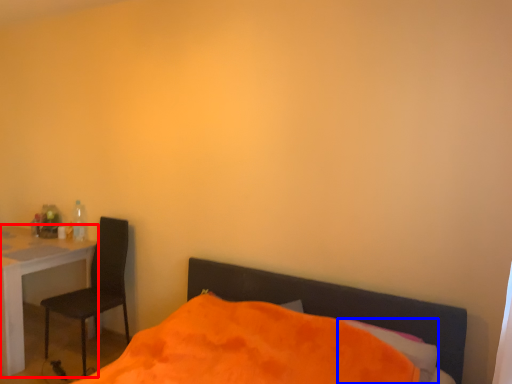
Question: Which object is closer to the camera taking this photo, desk (highlighted by a red box) or pillow (highlighted by a blue box)?

Choices:
 (A) desk
 (B) pillow

Answer: (B)